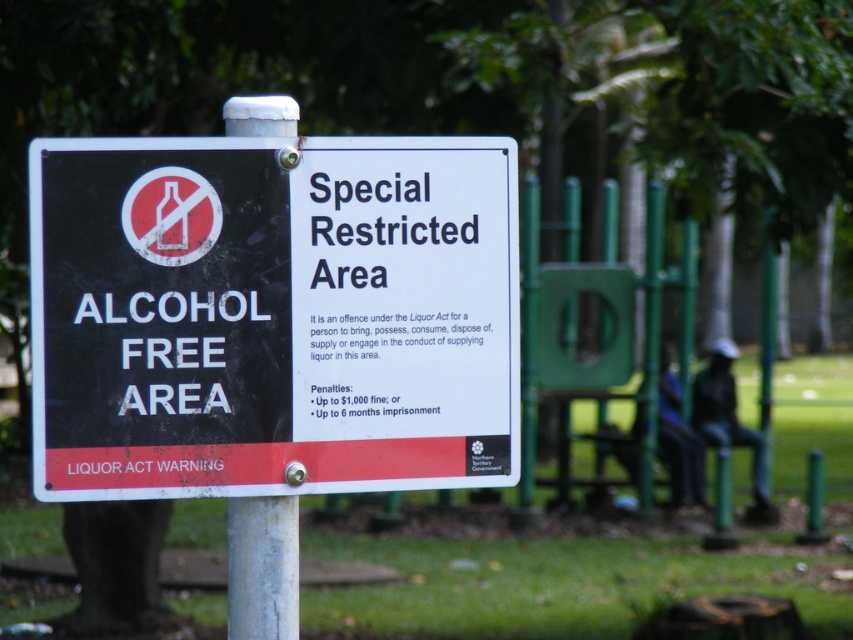
Between metallic signboard at center and white metallic pole at center, which one is positioned higher?

metallic signboard at center is higher up.

Can you confirm if metallic signboard at center is thinner than white metallic pole at center?

In fact, metallic signboard at center might be wider than white metallic pole at center.

Find the location of a particular element. The image size is (853, 640). metallic signboard at center is located at coordinates (271, 316).

At what (x,y) coordinates should I click in order to perform the action: click on metallic signboard at center. Please return your answer as a coordinate pair (x, y). Looking at the image, I should click on (271, 316).